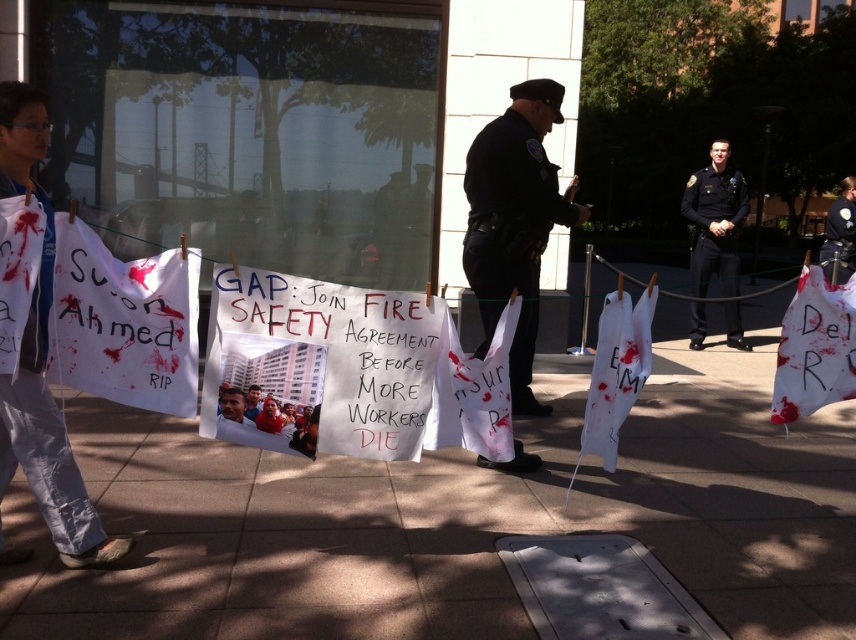
Which of these two, dark blue uniform at center or matte white shirt at center, stands shorter?

matte white shirt at center is shorter.

Which is below, dark blue uniform at center or matte white shirt at center?

matte white shirt at center is lower down.

Where is `dark blue uniform at center`? The image size is (856, 640). dark blue uniform at center is located at coordinates (515, 221).

Who is more distant from viewer, (712, 189) or (230, 403)?

Point (712, 189)

Consider the image. Can you confirm if dark blue uniform at right is positioned below matte white shirt at center?

Actually, dark blue uniform at right is above matte white shirt at center.

Is point (722, 154) farther from camera compared to point (220, 394)?

That is True.

Locate an element on the screen. dark blue uniform at right is located at coordinates (714, 220).

Does brown concrete pavement at lower center have a smaller size compared to matte white shirt at center?

No.

Can you confirm if brown concrete pavement at lower center is positioned to the left of matte white shirt at center?

Incorrect, brown concrete pavement at lower center is not on the left side of matte white shirt at center.

Does point (241, 552) come closer to viewer compared to point (244, 408)?

No, it is not.

The width and height of the screenshot is (856, 640). I want to click on brown concrete pavement at lower center, so tap(449, 524).